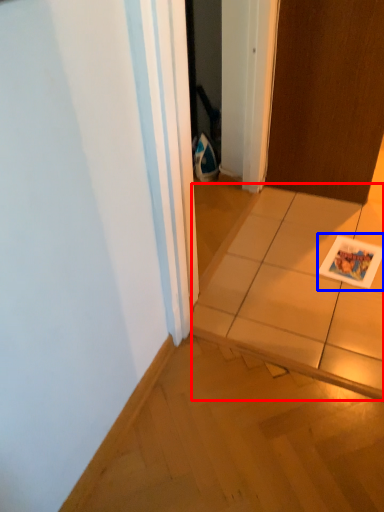
Question: Among these objects, which one is nearest to the camera, tile (highlighted by a red box) or postcard (highlighted by a blue box)?

Choices:
 (A) tile
 (B) postcard

Answer: (A)